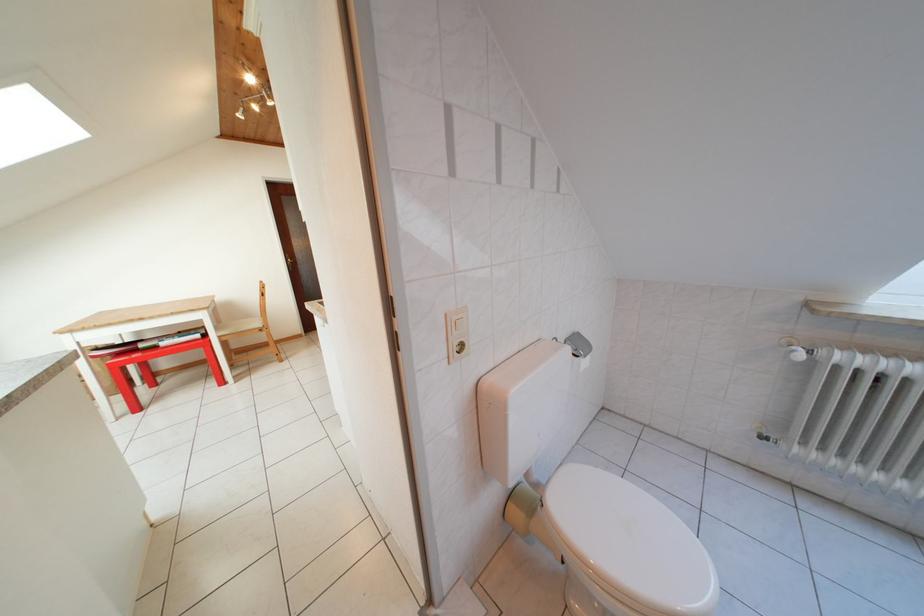
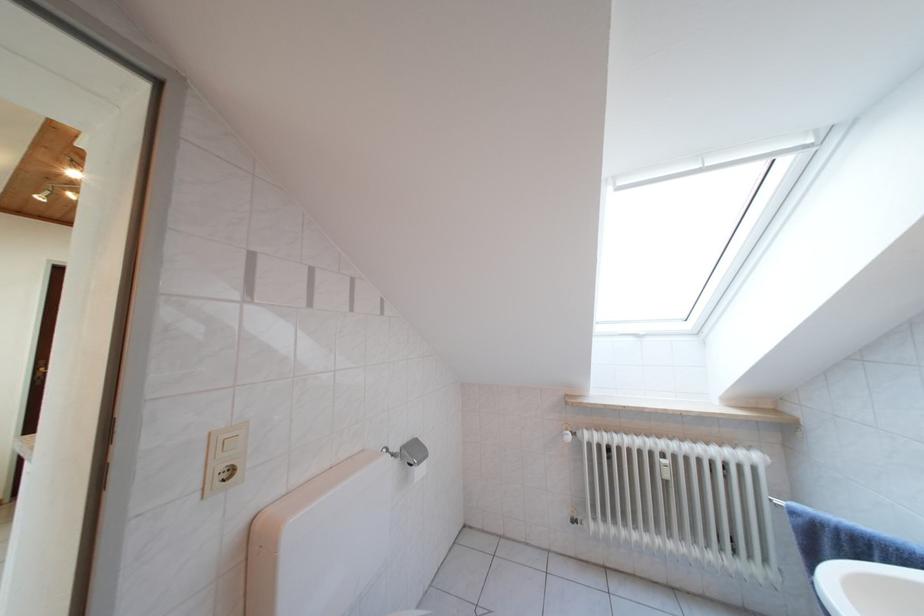
The first image is from the beginning of the video and the second image is from the end. How did the camera likely rotate when shooting the video?

The camera's rotation is toward right-up.